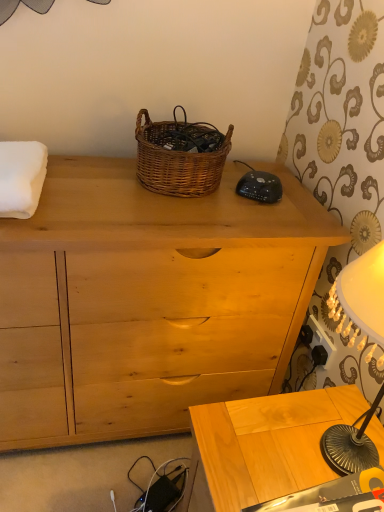
The width and height of the screenshot is (384, 512). What do you see at coordinates (321, 340) in the screenshot?
I see `black plastic power outlet at lower right` at bounding box center [321, 340].

The image size is (384, 512). I want to click on black plastic power outlet at lower right, so click(x=321, y=340).

Is woven brown picnic basket at center oriented away from black plastic power outlet at lower right?

That's not correct — woven brown picnic basket at center is not looking away from black plastic power outlet at lower right.

From the image's perspective, relative to black plastic power outlet at lower right, is woven brown picnic basket at center above or below?

Based on their image positions, woven brown picnic basket at center is located above black plastic power outlet at lower right.

Between woven brown picnic basket at center and black plastic power outlet at lower right, which one has larger size?

With larger size is woven brown picnic basket at center.

What are the coordinates of `picnic basket above the light wood table at lower right (from the image's perspective)` in the screenshot? It's located at click(x=180, y=155).

From a real-world perspective, is light wood table at lower right below woven brown picnic basket at center?

Yes, from a real-world perspective, light wood table at lower right is below woven brown picnic basket at center.

Is light wood table at lower right at the back of woven brown picnic basket at center?

No, light wood table at lower right is not at the back of woven brown picnic basket at center.

What's the angular difference between woven brown picnic basket at center and light wood table at lower right's facing directions?

90.2 degrees separate the facing orientations of woven brown picnic basket at center and light wood table at lower right.

Which object is further away from the camera taking this photo, woven brown picnic basket at center or light wood table at lower right?

woven brown picnic basket at center is further away from the camera.

Does woven brown picnic basket at center have a greater height compared to light wood table at lower right?

In fact, woven brown picnic basket at center may be shorter than light wood table at lower right.

Locate an element on the screen. picnic basket located above the natural wood chest of drawers at center (from the image's perspective) is located at coordinates (180, 155).

How much distance is there between woven brown picnic basket at center and natural wood chest of drawers at center?

woven brown picnic basket at center is 11.96 inches away from natural wood chest of drawers at center.

Does woven brown picnic basket at center turn towards natural wood chest of drawers at center?

No, woven brown picnic basket at center does not turn towards natural wood chest of drawers at center.

Considering the sizes of objects woven brown picnic basket at center and natural wood chest of drawers at center in the image provided, who is taller, woven brown picnic basket at center or natural wood chest of drawers at center?

natural wood chest of drawers at center.

Are black plastic power outlet at lower right and woven brown picnic basket at center located far from each other?

No, black plastic power outlet at lower right is in close proximity to woven brown picnic basket at center.

From a real-world perspective, is black plastic power outlet at lower right physically located above or below woven brown picnic basket at center?

Clearly, from a real-world perspective, black plastic power outlet at lower right is below woven brown picnic basket at center.

Would you say black plastic power outlet at lower right contains woven brown picnic basket at center?

No, black plastic power outlet at lower right does not contain woven brown picnic basket at center.

How far apart are black plastic power outlet at lower right and woven brown picnic basket at center?

The distance of black plastic power outlet at lower right from woven brown picnic basket at center is 23.65 inches.

From the image's perspective, is black plastic power outlet at lower right on top of natural wood chest of drawers at center?

No.

Considering the relative positions of black plastic power outlet at lower right and natural wood chest of drawers at center in the image provided, is black plastic power outlet at lower right to the left or to the right of natural wood chest of drawers at center?

Based on their positions, black plastic power outlet at lower right is located to the right of natural wood chest of drawers at center.

Is point (326, 347) closer to viewer compared to point (289, 340)?

Yes, point (326, 347) is in front of point (289, 340).

Does natural wood chest of drawers at center have a greater height compared to woven brown picnic basket at center?

Correct, natural wood chest of drawers at center is much taller as woven brown picnic basket at center.

Which object is thinner, natural wood chest of drawers at center or woven brown picnic basket at center?

With smaller width is woven brown picnic basket at center.

Is natural wood chest of drawers at center positioned beyond the bounds of woven brown picnic basket at center?

Absolutely, natural wood chest of drawers at center is external to woven brown picnic basket at center.

From the image's perspective, is natural wood chest of drawers at center above woven brown picnic basket at center?

No, from the image's perspective, natural wood chest of drawers at center is not above woven brown picnic basket at center.

Identify the location of picnic basket lying in front of the black plastic power outlet at lower right. (180, 155).

Find the location of a particular element. The width and height of the screenshot is (384, 512). picnic basket on the left of light wood table at lower right is located at coordinates (180, 155).

Based on their spatial positions, is natural wood chest of drawers at center or black plastic power outlet at lower right further from light wood table at lower right?

Based on the image, natural wood chest of drawers at center appears to be further to light wood table at lower right.

Considering their positions, is black plastic power outlet at lower right positioned closer to natural wood chest of drawers at center than woven brown picnic basket at center?

Among the two, woven brown picnic basket at center is located nearer to natural wood chest of drawers at center.

When comparing their distances from natural wood chest of drawers at center, does woven brown picnic basket at center or light wood table at lower right seem further?

Based on the image, light wood table at lower right appears to be further to natural wood chest of drawers at center.

Based on their spatial positions, is woven brown picnic basket at center or light wood table at lower right further from black plastic power outlet at lower right?

Based on the image, woven brown picnic basket at center appears to be further to black plastic power outlet at lower right.

Considering their positions, is black plastic power outlet at lower right positioned closer to light wood table at lower right than natural wood chest of drawers at center?

black plastic power outlet at lower right.

When comparing their distances from black plastic power outlet at lower right, does woven brown picnic basket at center or natural wood chest of drawers at center seem further?

woven brown picnic basket at center is further to black plastic power outlet at lower right.

Looking at the image, which one is located further to light wood table at lower right, woven brown picnic basket at center or natural wood chest of drawers at center?

woven brown picnic basket at center is further to light wood table at lower right.

When comparing their distances from light wood table at lower right, does woven brown picnic basket at center or black plastic power outlet at lower right seem further?

woven brown picnic basket at center.

What are the coordinates of `picnic basket located between natural wood chest of drawers at center and black plastic power outlet at lower right in the left-right direction` in the screenshot? It's located at (180, 155).

Where is `power outlet between woven brown picnic basket at center and light wood table at lower right in the vertical direction`? power outlet between woven brown picnic basket at center and light wood table at lower right in the vertical direction is located at coordinates (321, 340).

Find the location of `table situated between natural wood chest of drawers at center and black plastic power outlet at lower right from left to right`. table situated between natural wood chest of drawers at center and black plastic power outlet at lower right from left to right is located at coordinates (267, 444).

At what (x,y) coordinates should I click in order to perform the action: click on chest of drawers between woven brown picnic basket at center and light wood table at lower right in the vertical direction. Please return your answer as a coordinate pair (x, y). Looking at the image, I should click on (147, 301).